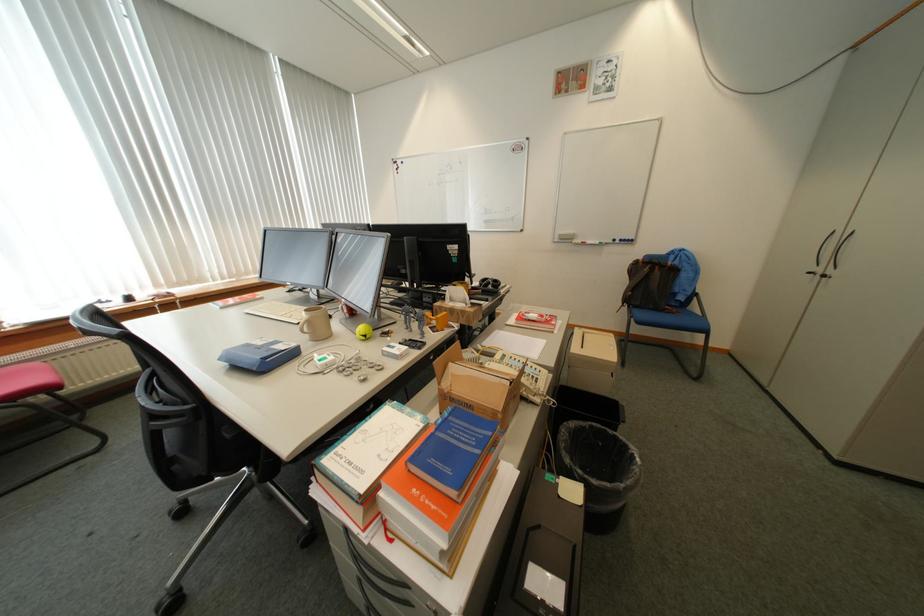
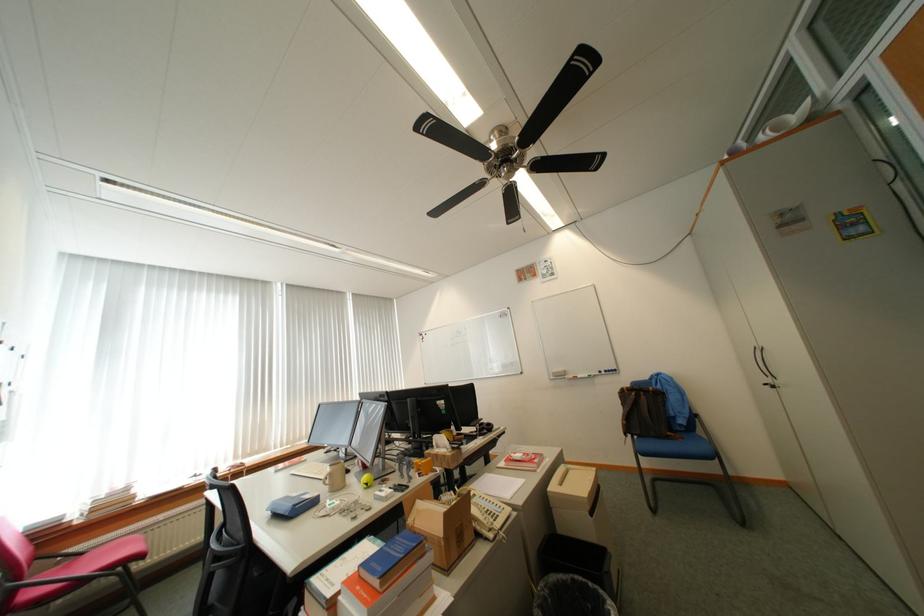
Question: How did the camera likely rotate?

Choices:
 (A) Left
 (B) Right
 (C) Up
 (D) Down

Answer: (C)